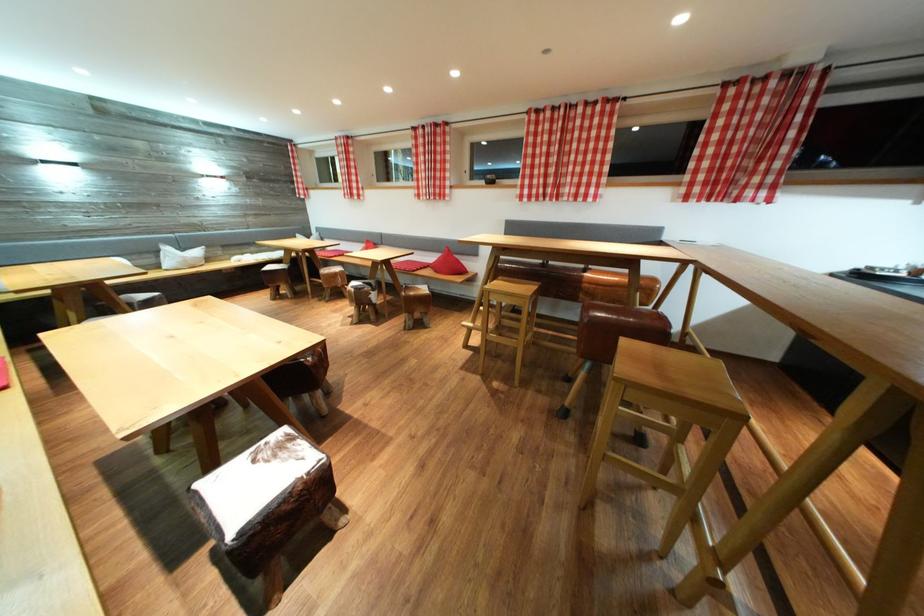
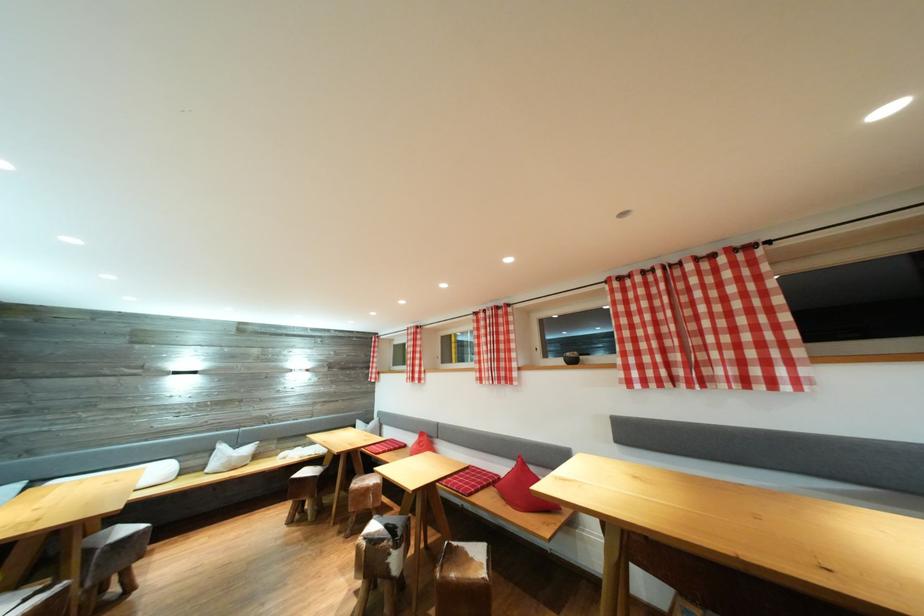
Find the pixel in the second image that matches the point at 362,294 in the first image.

(377, 546)